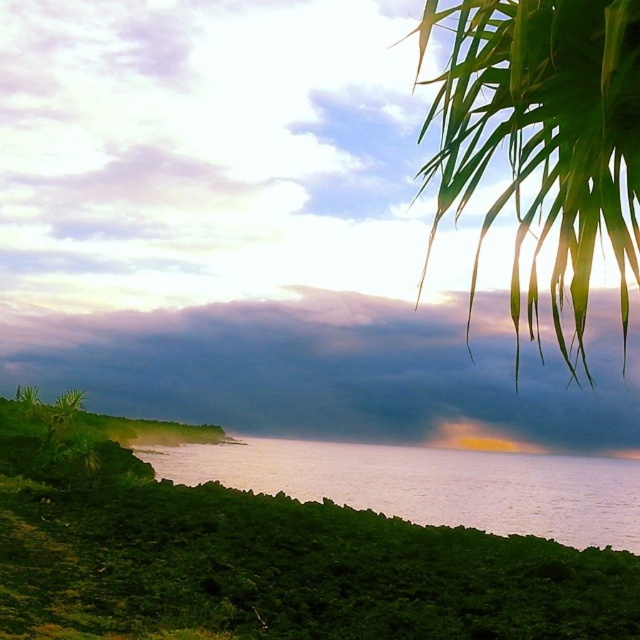
You are a weather observer noting the clouds and palm trees in the scene. Which object, the dark gray cloud at upper center or the green leafy palm at upper right, would cast a larger shadow during the current lighting conditions?

The dark gray cloud at upper center is larger in size than the green leafy palm at upper right, so it would cast a larger shadow during the current lighting conditions.

You are a photographer standing at the center of the scene. You want to take a photo that includes both the green leafy palm at upper right and the smooth water at lower left. What is the minimum distance you need to move to ensure both are in frame?

The minimum distance you need to move is 5.39 meters to ensure both the green leafy palm at upper right and the smooth water at lower left are in frame.